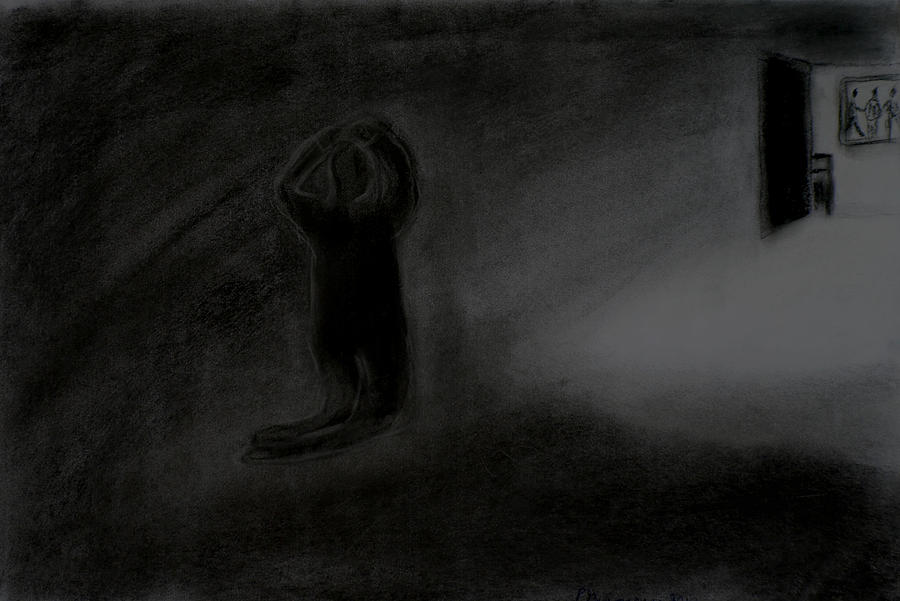
Where is `shadowy door`? This screenshot has height=601, width=900. shadowy door is located at coordinates (793, 124).